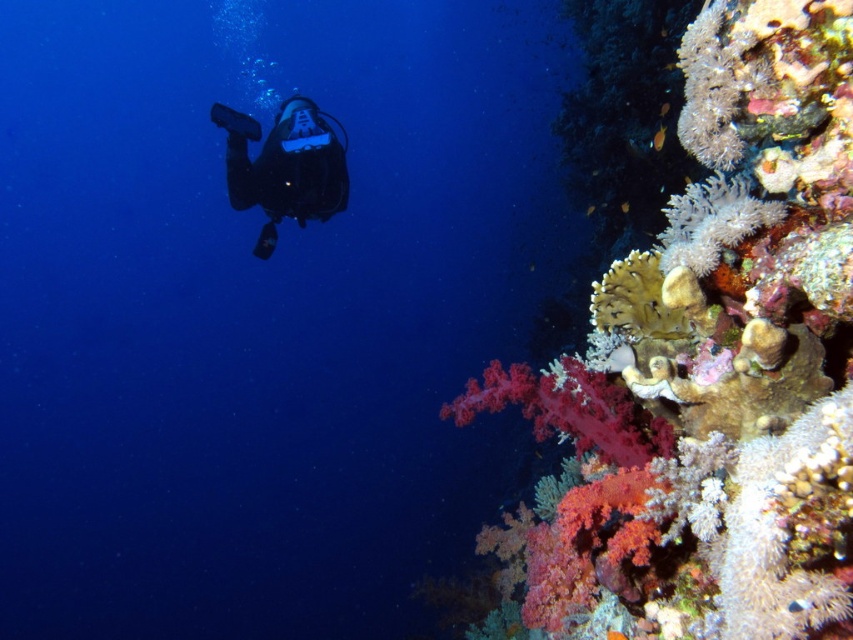
The height and width of the screenshot is (640, 853). What do you see at coordinates (285, 166) in the screenshot?
I see `black matte scuba diver at center` at bounding box center [285, 166].

Describe the element at coordinates (285, 166) in the screenshot. I see `black matte scuba diver at center` at that location.

Where is `black matte scuba diver at center`? black matte scuba diver at center is located at coordinates (285, 166).

Consider the image. Who is positioned more to the left, soft coral at upper right or white fluffy coral at right?

From the viewer's perspective, soft coral at upper right appears more on the left side.

Can you confirm if soft coral at upper right is positioned below white fluffy coral at right?

Yes.

Where is `soft coral at upper right`? The width and height of the screenshot is (853, 640). soft coral at upper right is located at coordinates (712, 365).

Who is more forward, (x=769, y=284) or (x=271, y=204)?

Positioned in front is point (x=769, y=284).

Find the location of `soft coral at upper right`. soft coral at upper right is located at coordinates (712, 365).